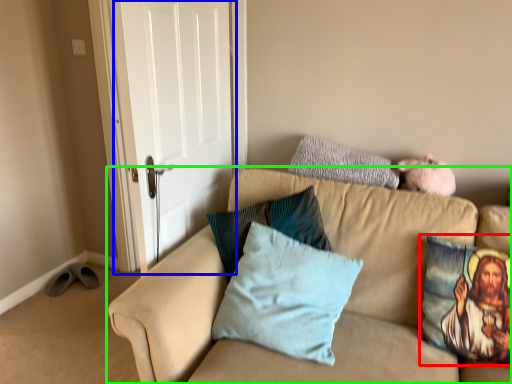
Question: Based on their relative distances, which object is farther from pillow (highlighted by a red box)? Choose from door (highlighted by a blue box) and studio couch (highlighted by a green box).

Choices:
 (A) door
 (B) studio couch

Answer: (A)